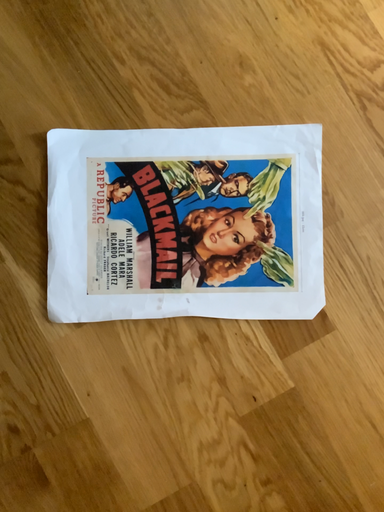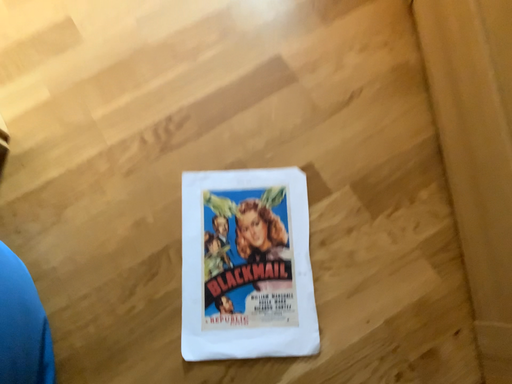
Question: How did the camera likely rotate when shooting the video?

Choices:
 (A) rotated downward
 (B) rotated upward

Answer: (B)